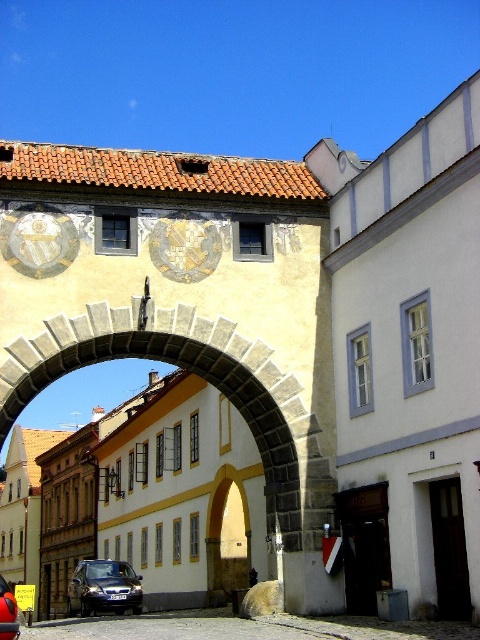
Question: Based on their relative distances, which object is farther from the gold textured clock at center?

Choices:
 (A) dark gray metallic car at lower left
 (B) stone archway at center
 (C) matte stone clock at upper center
 (D) shiny black car at center

Answer: (A)

Question: Is matte stone clock at upper center smaller than shiny black car at center?

Choices:
 (A) yes
 (B) no

Answer: (A)

Question: Can you confirm if matte stone clock at upper center is positioned to the right of gold textured clock at center?

Choices:
 (A) no
 (B) yes

Answer: (A)

Question: Can you confirm if stone archway at center is thinner than gold textured clock at center?

Choices:
 (A) no
 (B) yes

Answer: (A)

Question: Which object is closer to the camera taking this photo?

Choices:
 (A) matte stone clock at upper center
 (B) stone archway at center

Answer: (B)

Question: Estimate the real-world distances between objects in this image. Which object is closer to the shiny black car at center?

Choices:
 (A) matte stone clock at upper center
 (B) stone archway at center
 (C) gold textured clock at center
 (D) dark gray metallic car at lower left

Answer: (B)